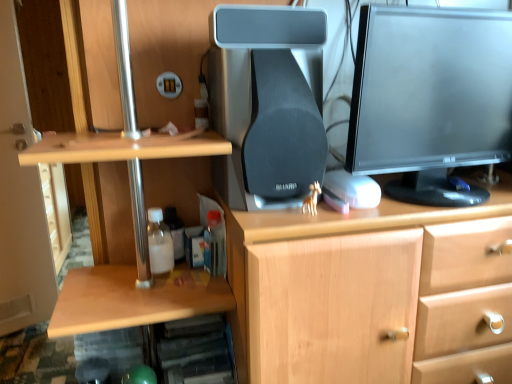
Question: Is black matte speaker at center taller or shorter than translucent plastic bottle at lower left, arranged as the 1th bottle when viewed from the left?

Choices:
 (A) short
 (B) tall

Answer: (B)

Question: Considering the positions of black matte speaker at center and translucent plastic bottle at lower left, arranged as the 2th bottle when viewed from the right, in the image, is black matte speaker at center wider or thinner than translucent plastic bottle at lower left, arranged as the 2th bottle when viewed from the right,?

Choices:
 (A) thin
 (B) wide

Answer: (B)

Question: Which object is the farthest from the translucent plastic bottle at lower left, arranged as the 1th bottle when viewed from the left?

Choices:
 (A) translucent plastic bottle at lower center, the first bottle viewed from the right
 (B) matte black monitor at upper right
 (C) black matte speaker at center

Answer: (B)

Question: Based on their relative distances, which object is nearer to the translucent plastic bottle at lower center, acting as the second bottle starting from the left?

Choices:
 (A) translucent plastic bottle at lower left, arranged as the 1th bottle when viewed from the left
 (B) black matte speaker at center
 (C) matte black monitor at upper right

Answer: (A)